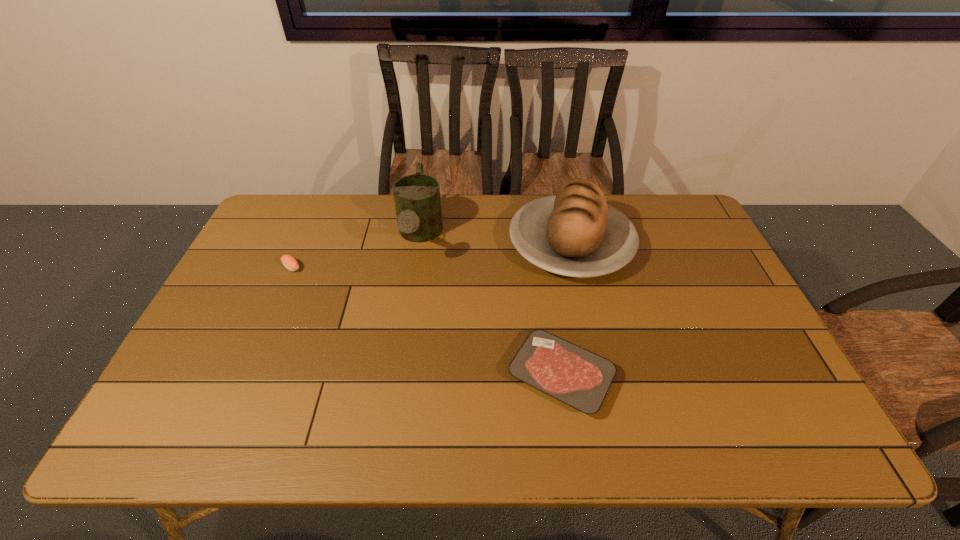
Identify the location of vacant space at the far right corner of the desktop. (643, 196).

You are a GUI agent. You are given a task and a screenshot of the screen. Output one action in this format:
    pyautogui.click(x=<x>, y=<y>)
    Task: Click on the empty location between the leftmost object and the shortest object
    The width and height of the screenshot is (960, 540).
    Given the screenshot: What is the action you would take?
    pyautogui.click(x=426, y=321)

Identify the location of free space between the steak and the leftmost object. (426, 321).

The width and height of the screenshot is (960, 540). In order to click on empty space between the bread and the watering can in this screenshot , I will do `click(495, 240)`.

Locate an element on the screen. The image size is (960, 540). vacant region between the bread and the second shortest object is located at coordinates (431, 255).

Locate an element on the screen. vacant space that is in between the shortest object and the bread is located at coordinates (565, 310).

Locate an element on the screen. The height and width of the screenshot is (540, 960). free spot between the second shortest object and the bread is located at coordinates (431, 255).

Identify the location of vacant area that lies between the bread and the nearest object. (565, 310).

At what (x,y) coordinates should I click in order to perform the action: click on vacant space that is in between the steak and the second shortest object. Please return your answer as a coordinate pair (x, y). Image resolution: width=960 pixels, height=540 pixels. Looking at the image, I should click on (426, 321).

You are a GUI agent. You are given a task and a screenshot of the screen. Output one action in this format:
    pyautogui.click(x=<x>, y=<y>)
    Task: Click on the vacant space in between the watering can and the leftmost object
    
    Given the screenshot: What is the action you would take?
    pyautogui.click(x=355, y=252)